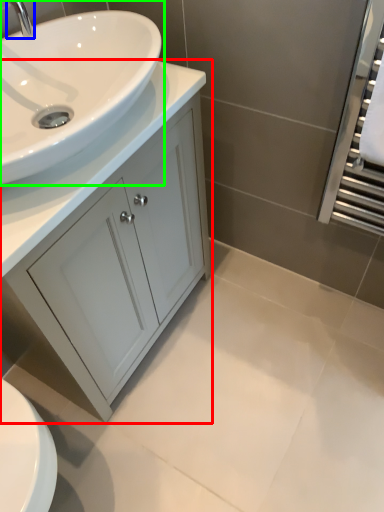
Question: Based on their relative distances, which object is farther from bathroom cabinet (highlighted by a red box)? Choose from tap (highlighted by a blue box) and sink (highlighted by a green box).

Choices:
 (A) tap
 (B) sink

Answer: (A)